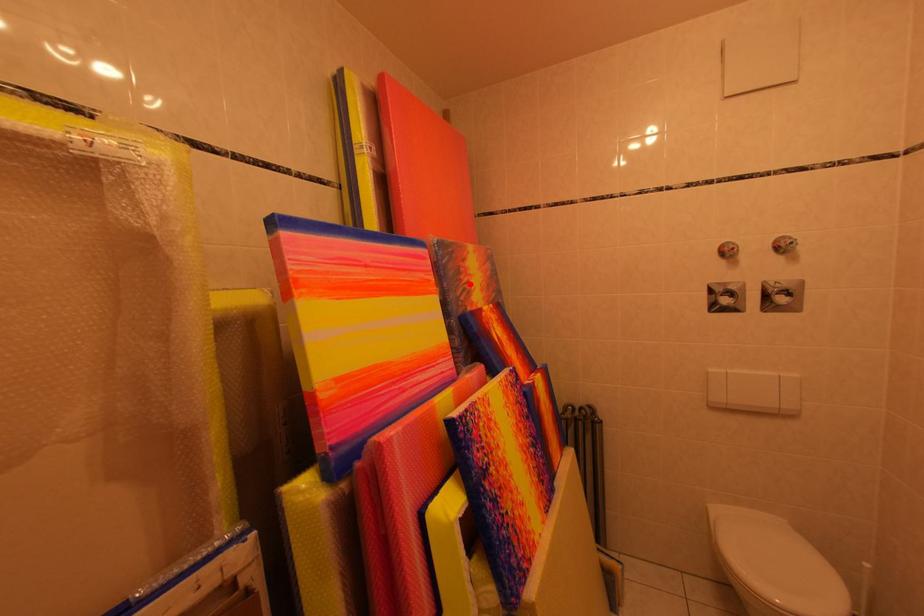
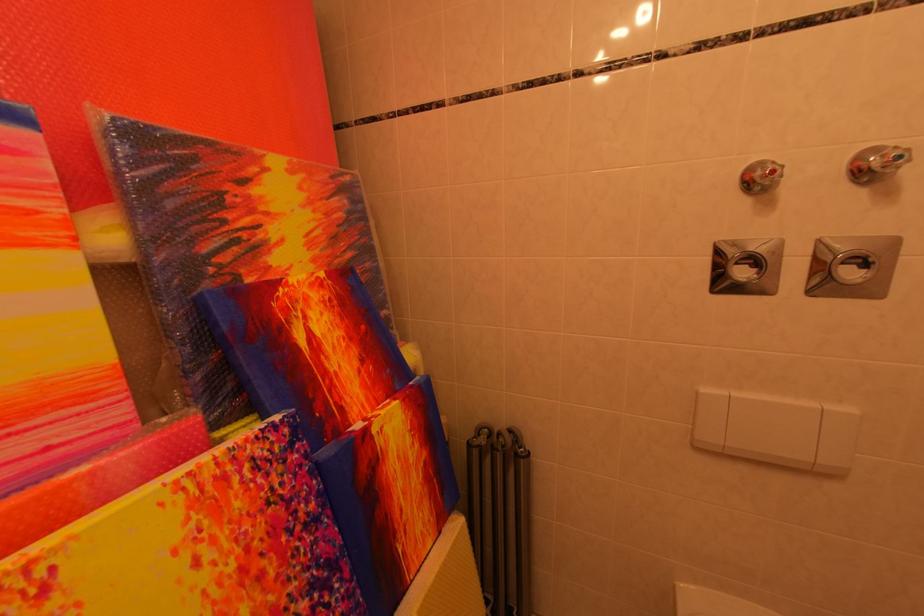
In the second image, find the point that corresponds to the highlighted location in the first image.

(233, 225)